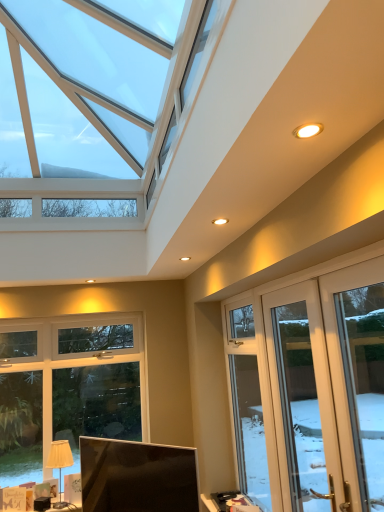
In order to face clear glass door at center, positioned as the second window in front-to-back order, should I rotate leftwards or rightwards?

To face it directly, rotate right by 7.208 degrees.

The image size is (384, 512). What do you see at coordinates (358, 376) in the screenshot?
I see `clear glass door at right, which is the second window from back to front` at bounding box center [358, 376].

Identify the location of beige fabric lampshade at lower left. The height and width of the screenshot is (512, 384). (60, 463).

This screenshot has height=512, width=384. What do you see at coordinates (60, 463) in the screenshot? I see `beige fabric lampshade at lower left` at bounding box center [60, 463].

The image size is (384, 512). Identify the location of white glossy door at right, the second screen door from the front. (303, 399).

Considering the relative positions of beige fabric lampshade at lower left and matte black monitor at lower center in the image provided, is beige fabric lampshade at lower left to the left or to the right of matte black monitor at lower center?

Based on their positions, beige fabric lampshade at lower left is located to the left of matte black monitor at lower center.

Which is in front, beige fabric lampshade at lower left or matte black monitor at lower center?

Positioned in front is matte black monitor at lower center.

Is beige fabric lampshade at lower left aimed at matte black monitor at lower center?

No, beige fabric lampshade at lower left is not facing towards matte black monitor at lower center.

From a real-world perspective, is clear glass door at right, which is the second window from back to front, under white glossy door at right, the second screen door from the front?

No, from a real-world perspective, clear glass door at right, which is the second window from back to front, is not below white glossy door at right, the second screen door from the front.

Is clear glass door at right, which is the second window from back to front, far away from white glossy door at right, the second screen door from the front?

Indeed, clear glass door at right, which is the second window from back to front, is not near white glossy door at right, the second screen door from the front.

In the scene shown: Considering the sizes of objects clear glass door at right, acting as the 2th window starting from the left, and white glossy door at right, acting as the first screen door starting from the back, in the image provided, who is shorter, clear glass door at right, acting as the 2th window starting from the left, or white glossy door at right, acting as the first screen door starting from the back,?

With less height is clear glass door at right, acting as the 2th window starting from the left.

Find the location of a particular element. This screenshot has width=384, height=512. window lying above the white glossy door at right, the second screen door from the front (from the image's perspective) is located at coordinates (358, 376).

Which is nearer, [267,467] or [345,497]?

Positioned in front is point [345,497].

Locate an element on the screen. Image resolution: width=384 pixels, height=512 pixels. window behind the clear glass door at right, placed as the first window when sorted from right to left is located at coordinates (252, 404).

From the image's perspective, which one is positioned higher, clear glass door at center, which is the 1th window from left to right, or clear glass door at right, acting as the 1th window starting from the front?

clear glass door at right, acting as the 1th window starting from the front, is shown above in the image.

Is clear glass door at center, positioned as the second window in front-to-back order, in contact with clear glass door at right, which is the second window from back to front?

clear glass door at center, positioned as the second window in front-to-back order, and clear glass door at right, which is the second window from back to front, are not in contact.

From the image's perspective, which one is positioned higher, matte black monitor at lower center or matte white screen door at lower right, acting as the second screen door starting from the back?

From the image's view, matte white screen door at lower right, acting as the second screen door starting from the back, is above.

Considering the relative sizes of matte black monitor at lower center and matte white screen door at lower right, positioned as the first screen door in front-to-back order, in the image provided, is matte black monitor at lower center smaller than matte white screen door at lower right, positioned as the first screen door in front-to-back order,?

Indeed, matte black monitor at lower center has a smaller size compared to matte white screen door at lower right, positioned as the first screen door in front-to-back order.

Is matte black monitor at lower center inside or outside of matte white screen door at lower right, acting as the second screen door starting from the back?

matte black monitor at lower center is outside matte white screen door at lower right, acting as the second screen door starting from the back.

At what (x,y) coordinates should I click in order to perform the action: click on computer monitor that appears on the left of matte white screen door at lower right, acting as the second screen door starting from the back. Please return your answer as a coordinate pair (x, y). This screenshot has width=384, height=512. Looking at the image, I should click on (137, 477).

From a real-world perspective, is beige fabric lampshade at lower left physically below matte white screen door at lower right, positioned as the first screen door in front-to-back order?

Yes, from a real-world perspective, beige fabric lampshade at lower left is below matte white screen door at lower right, positioned as the first screen door in front-to-back order.

Is beige fabric lampshade at lower left touching matte white screen door at lower right, acting as the second screen door starting from the back?

No, beige fabric lampshade at lower left is not next to matte white screen door at lower right, acting as the second screen door starting from the back.

How many degrees apart are the facing directions of beige fabric lampshade at lower left and matte white screen door at lower right, acting as the second screen door starting from the back?

The angle between the facing direction of beige fabric lampshade at lower left and the facing direction of matte white screen door at lower right, acting as the second screen door starting from the back, is 89.1 degrees.

Which of these two, beige fabric lampshade at lower left or matte white screen door at lower right, acting as the second screen door starting from the back, is wider?

beige fabric lampshade at lower left.

Could you tell me if clear glass door at center, which is the 1th window from left to right, is turned towards matte black monitor at lower center?

Yes, clear glass door at center, which is the 1th window from left to right, is aimed at matte black monitor at lower center.

This screenshot has height=512, width=384. In the image, there is a clear glass door at center, arranged as the 1th window when viewed from the back. In order to click on computer monitor below it (from a real-world perspective) in this screenshot , I will do `click(137, 477)`.

From a real-world perspective, is clear glass door at center, which is the 1th window from left to right, on top of matte black monitor at lower center?

Yes, from a real-world perspective, clear glass door at center, which is the 1th window from left to right, is over matte black monitor at lower center

Is clear glass door at center, arranged as the 1th window when viewed from the back, shorter than matte black monitor at lower center?

No, clear glass door at center, arranged as the 1th window when viewed from the back, is not shorter than matte black monitor at lower center.

Does point (290, 298) come closer to viewer compared to point (177, 472)?

Yes, point (290, 298) is in front of point (177, 472).

From the picture: In the image, is white glossy door at right, acting as the first screen door starting from the back, on the left side or the right side of matte black monitor at lower center?

Based on their positions, white glossy door at right, acting as the first screen door starting from the back, is located to the right of matte black monitor at lower center.

From the image's perspective, which one is positioned higher, white glossy door at right, the second screen door from the front, or matte black monitor at lower center?

white glossy door at right, the second screen door from the front.

How many degrees apart are the facing directions of white glossy door at right, the second screen door from the front, and matte black monitor at lower center?

The facing directions of white glossy door at right, the second screen door from the front, and matte black monitor at lower center are 41.7 degrees apart.

The image size is (384, 512). I want to click on table lamp located below the matte black monitor at lower center (from the image's perspective), so click(60, 463).

At what (x,y) coordinates should I click in order to perform the action: click on the 2nd screen door to the left when counting from the clear glass door at right, acting as the 1th window starting from the front. Please return your answer as a coordinate pair (x, y). The height and width of the screenshot is (512, 384). Looking at the image, I should click on (303, 399).

Based on their spatial positions, is clear glass door at center, positioned as the second window in front-to-back order, or matte white screen door at lower right, positioned as the first screen door in front-to-back order, further from white glossy door at right, acting as the first screen door starting from the back?

The object further to white glossy door at right, acting as the first screen door starting from the back, is clear glass door at center, positioned as the second window in front-to-back order.

When comparing their distances from clear glass door at right, placed as the first window when sorted from right to left, does white glossy door at right, the second screen door from the front, or beige fabric lampshade at lower left seem closer?

The object closer to clear glass door at right, placed as the first window when sorted from right to left, is white glossy door at right, the second screen door from the front.

Estimate the real-world distances between objects in this image. Which object is further from white glossy door at right, acting as the first screen door starting from the back, matte white screen door at lower right, acting as the second screen door starting from the back, or clear glass door at right, acting as the 2th window starting from the left?

Based on the image, clear glass door at right, acting as the 2th window starting from the left, appears to be further to white glossy door at right, acting as the first screen door starting from the back.

Looking at the image, which one is located closer to clear glass door at center, positioned as the second window in front-to-back order, white glossy door at right, acting as the first screen door starting from the back, or clear glass door at right, placed as the first window when sorted from right to left?

Based on the image, white glossy door at right, acting as the first screen door starting from the back, appears to be nearer to clear glass door at center, positioned as the second window in front-to-back order.

Looking at the image, which one is located further to matte white screen door at lower right, acting as the second screen door starting from the back, clear glass door at center, arranged as the 1th window when viewed from the back, or white glossy door at right, acting as the first screen door starting from the back?

The object further to matte white screen door at lower right, acting as the second screen door starting from the back, is clear glass door at center, arranged as the 1th window when viewed from the back.

From the image, which object appears to be farther from clear glass door at right, which is the second window from back to front, beige fabric lampshade at lower left or white glossy door at right, acting as the first screen door starting from the back?

beige fabric lampshade at lower left.

Which object lies further to the anchor point beige fabric lampshade at lower left, clear glass door at center, positioned as the second window in front-to-back order, or matte black monitor at lower center?

Among the two, clear glass door at center, positioned as the second window in front-to-back order, is located further to beige fabric lampshade at lower left.

From the image, which object appears to be farther from clear glass door at center, the 2th window viewed from the right, clear glass door at right, which is the second window from back to front, or matte white screen door at lower right, acting as the second screen door starting from the back?

clear glass door at right, which is the second window from back to front.

The width and height of the screenshot is (384, 512). What are the coordinates of `computer monitor located between matte white screen door at lower right, acting as the second screen door starting from the back, and clear glass door at center, the 2th window viewed from the right, in the depth direction` in the screenshot? It's located at (137, 477).

Locate an element on the screen. screen door between matte white screen door at lower right, positioned as the first screen door in front-to-back order, and beige fabric lampshade at lower left from front to back is located at coordinates (303, 399).

Image resolution: width=384 pixels, height=512 pixels. What are the coordinates of `window between clear glass door at right, acting as the 2th window starting from the left, and beige fabric lampshade at lower left in the front-back direction` in the screenshot? It's located at (252, 404).

Identify the location of computer monitor between beige fabric lampshade at lower left and clear glass door at center, positioned as the second window in front-to-back order. The image size is (384, 512). (137, 477).